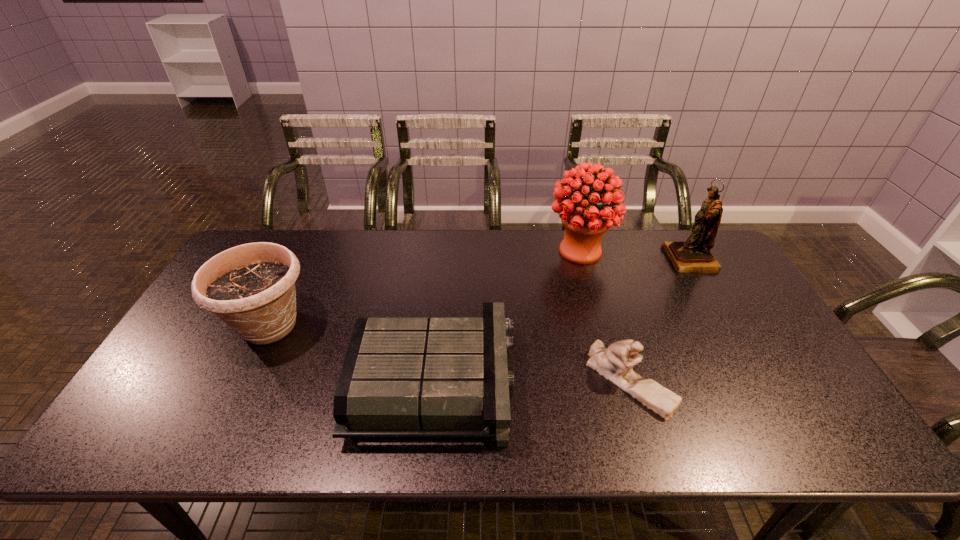
This screenshot has height=540, width=960. What are the coordinates of `unoccupied position between the rightmost object and the shorter figurine` in the screenshot? It's located at (660, 321).

Identify the location of blank region between the bouquet and the shorter figurine. The image size is (960, 540). (605, 316).

Find the location of `free space between the rightmost object and the radio receiver`. free space between the rightmost object and the radio receiver is located at coordinates (563, 321).

The height and width of the screenshot is (540, 960). What are the coordinates of `vacant area between the bouquet and the leftmost object` in the screenshot? It's located at (424, 288).

At what (x,y) coordinates should I click in order to perform the action: click on blank region between the right figurine and the fourth tallest object. Please return your answer as a coordinate pair (x, y). This screenshot has width=960, height=540. Looking at the image, I should click on pyautogui.click(x=660, y=321).

You are a GUI agent. You are given a task and a screenshot of the screen. Output one action in this format:
    pyautogui.click(x=<x>, y=<y>)
    Task: Click on the free spot between the bouquet and the radio receiver
    This screenshot has height=540, width=960.
    Given the screenshot: What is the action you would take?
    pyautogui.click(x=507, y=316)

Where is `object that is the fourth closest to the flowerpot`? The width and height of the screenshot is (960, 540). object that is the fourth closest to the flowerpot is located at coordinates (693, 255).

The image size is (960, 540). Find the location of `object that is the third closest to the bouquet`. object that is the third closest to the bouquet is located at coordinates (614, 363).

Locate an element on the screen. free space in the image that satisfies the following two spatial constraints: 1. on the front-facing side of the right figurine; 2. on the front-facing side of the fourth tallest object is located at coordinates (759, 381).

Where is `free space that satisfies the following two spatial constraints: 1. on the front-facing side of the nearer figurine; 2. on the front panel of the fourth object from right to left`? Image resolution: width=960 pixels, height=540 pixels. free space that satisfies the following two spatial constraints: 1. on the front-facing side of the nearer figurine; 2. on the front panel of the fourth object from right to left is located at coordinates (630, 382).